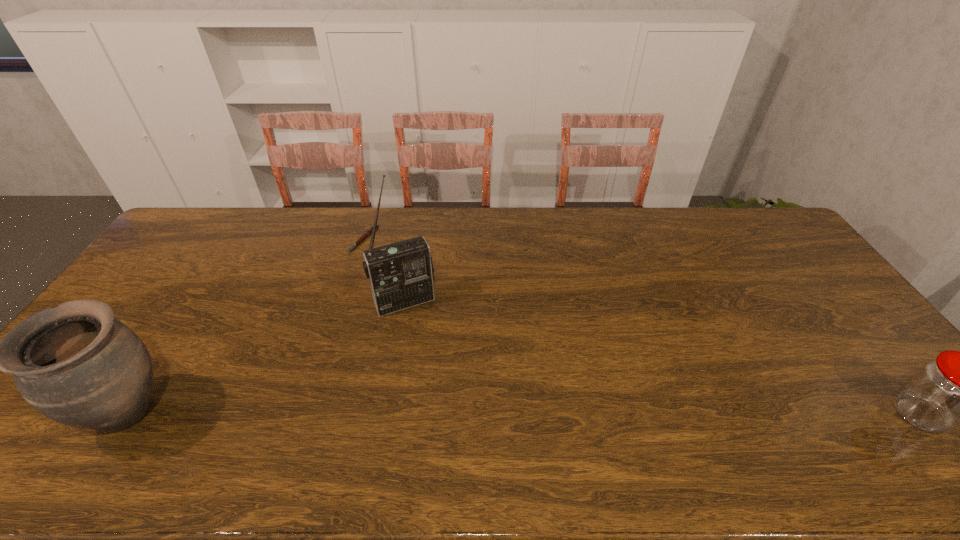
This screenshot has height=540, width=960. In the image, there is a desktop. Identify the location of vacant area at the right edge. (761, 259).

Locate an element on the screen. The height and width of the screenshot is (540, 960). free space at the far left corner of the desktop is located at coordinates (x=191, y=241).

Locate an element on the screen. free space between the urn and the pen is located at coordinates (248, 326).

Where is `vacant point located between the farthest object and the second tallest object`? vacant point located between the farthest object and the second tallest object is located at coordinates (248, 326).

Image resolution: width=960 pixels, height=540 pixels. What are the coordinates of `free spot between the leftmost object and the second object from left to right` in the screenshot? It's located at (248, 326).

The height and width of the screenshot is (540, 960). I want to click on vacant area that lies between the urn and the second object from right to left, so click(x=268, y=357).

Image resolution: width=960 pixels, height=540 pixels. In order to click on vacant region between the second farthest object and the third shortest object in this screenshot , I will do `click(268, 357)`.

Select which object appears as the second closest to the second shortest object. Please provide its 2D coordinates. Your answer should be formatted as a tuple, i.e. [(x, y)], where the tuple contains the x and y coordinates of a point satisfying the conditions above.

[(368, 232)]

Choose which object is the second nearest neighbor to the pen. Please provide its 2D coordinates. Your answer should be formatted as a tuple, i.e. [(x, y)], where the tuple contains the x and y coordinates of a point satisfying the conditions above.

[(76, 364)]